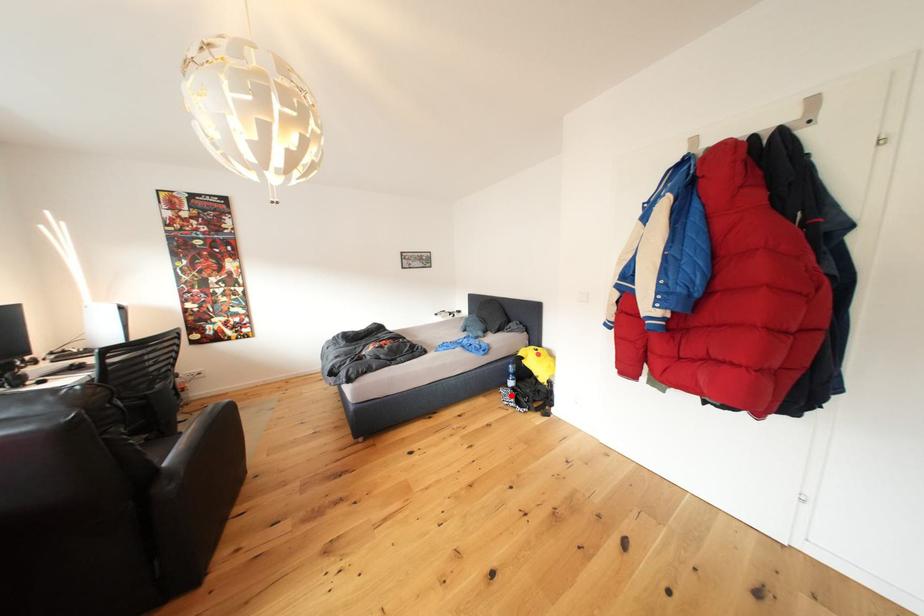
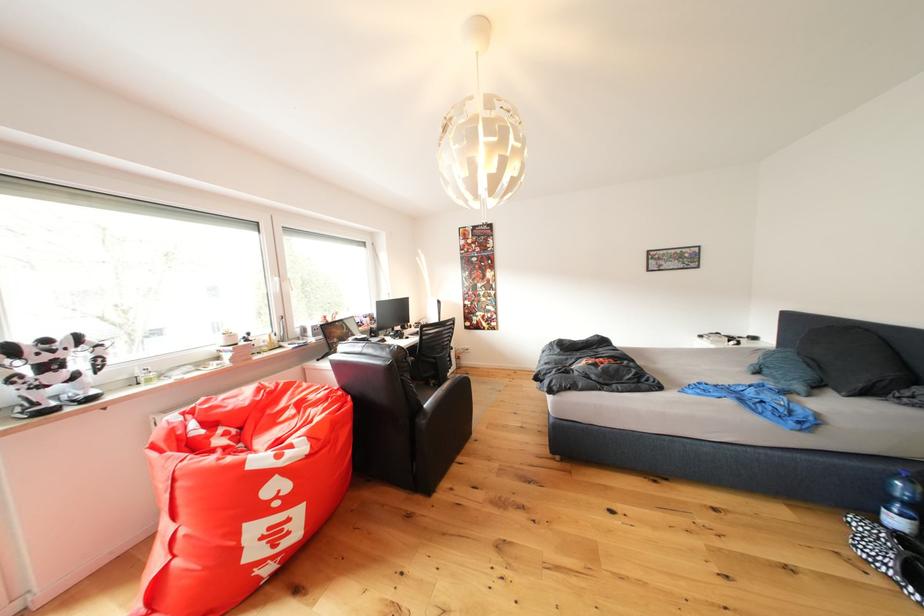
Question: I am providing you with two images of the same scene from different viewpoints. In image1, a red point is highlighted. Considering the same 3D point in image2, which of the following is correct?

Choices:
 (A) It is closer
 (B) It is farther

Answer: (A)